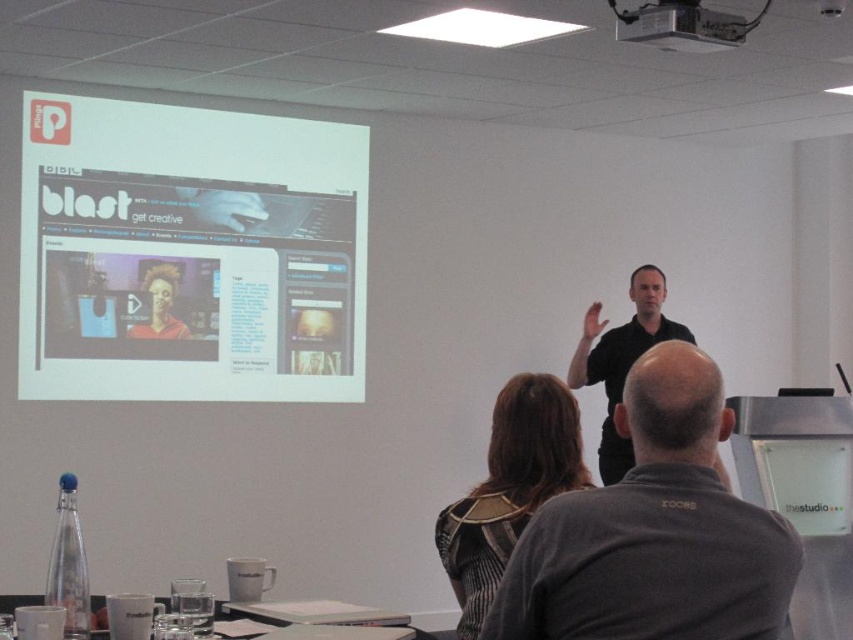
Does white matte projection screen at upper left have a greater height compared to metallic projector at upper center?

Indeed, white matte projection screen at upper left has a greater height compared to metallic projector at upper center.

Who is more distant from viewer, [357,321] or [720,44]?

The point [357,321] is more distant.

This screenshot has height=640, width=853. Describe the element at coordinates (190, 252) in the screenshot. I see `white matte projection screen at upper left` at that location.

You are a GUI agent. You are given a task and a screenshot of the screen. Output one action in this format:
    pyautogui.click(x=<x>, y=<y>)
    Task: Click on the white matte projection screen at upper left
    This screenshot has height=640, width=853.
    Given the screenshot: What is the action you would take?
    pyautogui.click(x=190, y=252)

Is point (286, 195) positioned before point (561, 442)?

No, it is not.

Identify the location of white matte projection screen at upper left. Image resolution: width=853 pixels, height=640 pixels. (190, 252).

Is striped fabric dress at center thinner than black matte shirt at center?

Yes.

Can you confirm if striped fabric dress at center is positioned to the left of black matte shirt at center?

Indeed, striped fabric dress at center is positioned on the left side of black matte shirt at center.

Where is `striped fabric dress at center`? Image resolution: width=853 pixels, height=640 pixels. striped fabric dress at center is located at coordinates pyautogui.click(x=509, y=488).

The image size is (853, 640). I want to click on striped fabric dress at center, so click(509, 488).